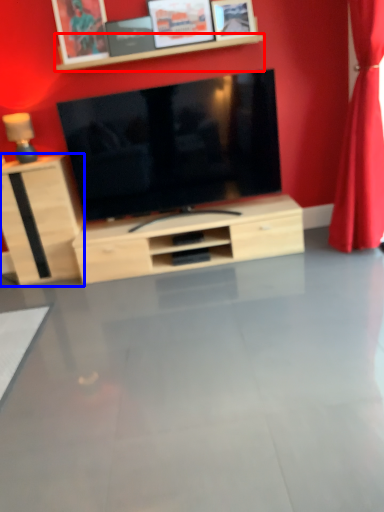
Question: Which object appears closest to the camera in this image, shelf (highlighted by a red box) or cabinetry (highlighted by a blue box)?

Choices:
 (A) shelf
 (B) cabinetry

Answer: (A)